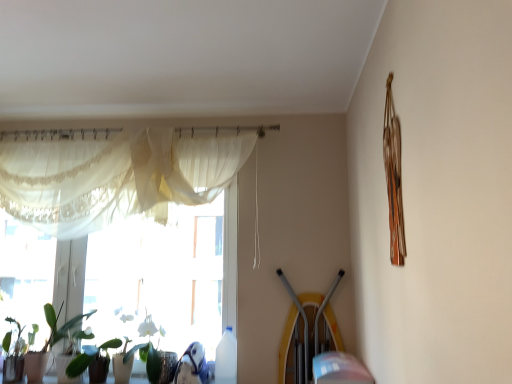
Question: Is green glossy plant at lower left wider or thinner than sheer white curtain at upper left?

Choices:
 (A) thin
 (B) wide

Answer: (B)

Question: Relative to sheer white curtain at upper left, is green glossy plant at lower left in front or behind?

Choices:
 (A) behind
 (B) front

Answer: (A)

Question: Considering the real-world distances, which object is closest to the green glossy plant at lower left?

Choices:
 (A) translucent fabric at left
 (B) sheer white curtain at upper left
 (C) green matte plant at lower left

Answer: (C)

Question: Which object is positioned farthest from the green matte plant at lower left?

Choices:
 (A) green glossy plant at lower left
 (B) translucent fabric at left
 (C) sheer white curtain at upper left

Answer: (B)